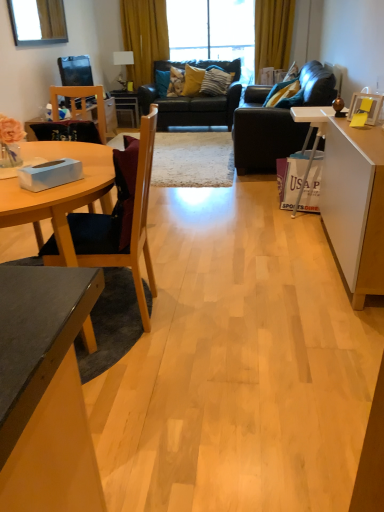
Where is `free space on the front side of wooden chair at left, arranged as the 2th chair when viewed from the top`? The image size is (384, 512). free space on the front side of wooden chair at left, arranged as the 2th chair when viewed from the top is located at coordinates (157, 369).